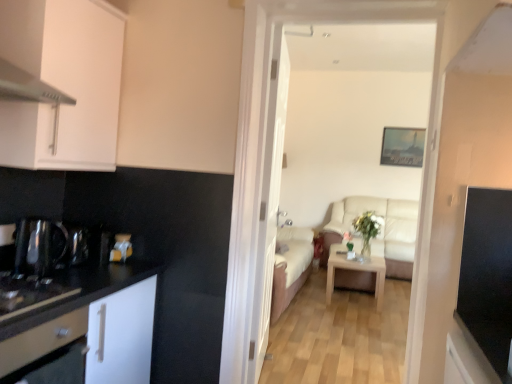
Question: Does beige fabric sofa at center lie in front of white matte cabinet at upper left, acting as the first cabinetry starting from the top?

Choices:
 (A) no
 (B) yes

Answer: (A)

Question: Is beige fabric sofa at center not inside white matte cabinet at upper left, acting as the first cabinetry starting from the top?

Choices:
 (A) no
 (B) yes

Answer: (B)

Question: Is beige fabric sofa at center at the right side of white matte cabinet at upper left, the second cabinetry in the bottom-to-top sequence?

Choices:
 (A) yes
 (B) no

Answer: (A)

Question: Is the surface of beige fabric sofa at center in direct contact with white matte cabinet at upper left, acting as the first cabinetry starting from the top?

Choices:
 (A) yes
 (B) no

Answer: (B)

Question: From a real-world perspective, is beige fabric sofa at center positioned under white matte cabinet at upper left, the second cabinetry in the bottom-to-top sequence, based on gravity?

Choices:
 (A) yes
 (B) no

Answer: (A)

Question: Is beige fabric sofa at center taller than white matte cabinet at upper left, the second cabinetry in the bottom-to-top sequence?

Choices:
 (A) no
 (B) yes

Answer: (B)

Question: Would you say light wood/texture coffee table at center is part of beige fabric sofa at center's contents?

Choices:
 (A) yes
 (B) no

Answer: (B)

Question: From a real-world perspective, does beige fabric sofa at center stand above light wood/texture coffee table at center?

Choices:
 (A) no
 (B) yes

Answer: (B)

Question: Can we say beige fabric sofa at center lies outside light wood/texture coffee table at center?

Choices:
 (A) no
 (B) yes

Answer: (B)

Question: Can you confirm if beige fabric sofa at center is positioned to the left of light wood/texture coffee table at center?

Choices:
 (A) no
 (B) yes

Answer: (B)

Question: Is beige fabric sofa at center behind light wood/texture coffee table at center?

Choices:
 (A) yes
 (B) no

Answer: (B)

Question: Is beige fabric sofa at center far away from light wood/texture coffee table at center?

Choices:
 (A) yes
 (B) no

Answer: (A)

Question: Is the depth of light wood/texture coffee table at center less than that of white glossy drawer at left?

Choices:
 (A) no
 (B) yes

Answer: (A)